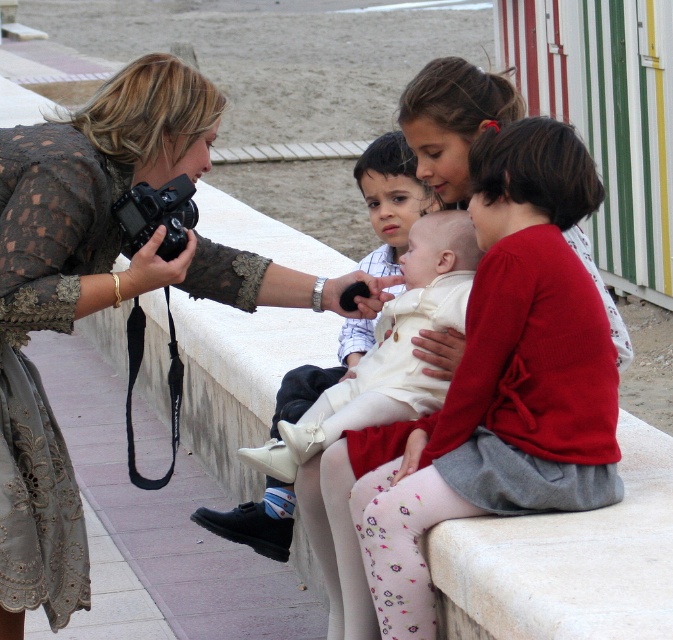
You are standing in front of the scene and want to know which point is closer to you between point (441,480) and point (17,525). Which one is closer?

Point (441,480) is closer to you than point (17,525).

You are a photographer trying to capture the scene. The white cotton dress at center and the black plastic camera at left are both in your viewfinder. Which object is positioned higher in the frame?

The white cotton dress at center is much taller as the black plastic camera at left, so the white cotton dress at center is positioned higher in the frame.

You are a photographer trying to capture a candid shot of the children on the wall. You notice the white cotton dress at center and the black plastic camera at left. Which object is closer to you, the photographer?

The white cotton dress at center is closer to you because it is further to the viewer than the black plastic camera at left.